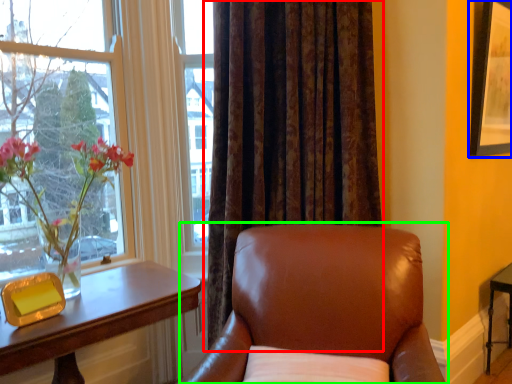
Question: Considering the real-world distances, which object is closest to curtain (highlighted by a red box)? picture frame (highlighted by a blue box) or chair (highlighted by a green box).

Choices:
 (A) picture frame
 (B) chair

Answer: (B)